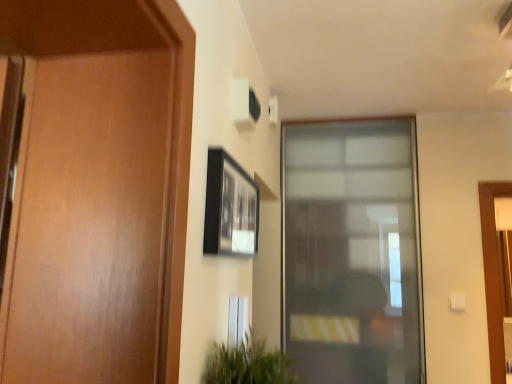
Question: Looking at their shapes, would you say transparent glass window at center is wider or thinner than black matte picture frame at upper center?

Choices:
 (A) wide
 (B) thin

Answer: (A)

Question: Is transparent glass window at center inside the boundaries of black matte picture frame at upper center, or outside?

Choices:
 (A) inside
 (B) outside

Answer: (B)

Question: Considering the real-world distances, which object is farthest from the transparent glass window at center?

Choices:
 (A) black matte picture frame at upper center
 (B) green leafy plant at lower center

Answer: (B)

Question: Based on their relative distances, which object is nearer to the transparent glass window at center?

Choices:
 (A) black matte picture frame at upper center
 (B) green leafy plant at lower center

Answer: (A)